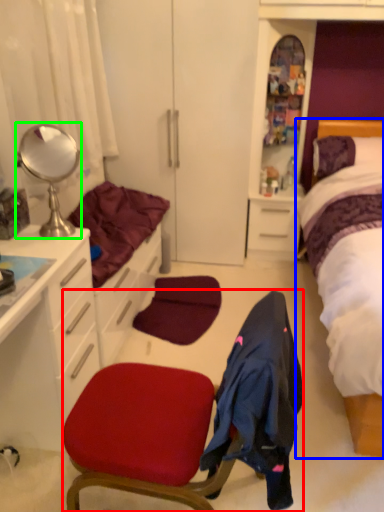
Question: Considering the real-world distances, which object is farthest from chair (highlighted by a red box)? bed (highlighted by a blue box) or mirror (highlighted by a green box)?

Choices:
 (A) bed
 (B) mirror

Answer: (A)